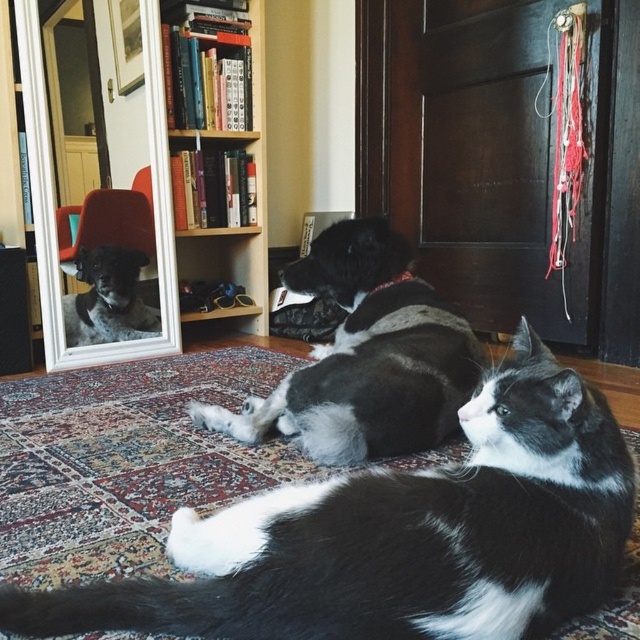
Question: Does black and white fur at center appear on the left side of wooden bookshelf at upper center?

Choices:
 (A) no
 (B) yes

Answer: (A)

Question: Which of the following is the farthest from the observer?

Choices:
 (A) black and white fur cat at center
 (B) black and white fur at center

Answer: (B)

Question: Is the position of black and white fur at center more distant than that of white-framed mirror at upper left?

Choices:
 (A) yes
 (B) no

Answer: (B)

Question: Which object is farther from the camera taking this photo?

Choices:
 (A) white-framed mirror at upper left
 (B) black and white fur cat at center

Answer: (A)

Question: Which point is farther from the camera taking this photo?

Choices:
 (A) (252, 234)
 (B) (51, 180)
 (C) (440, 346)
 (D) (456, 493)

Answer: (A)

Question: Is black and white fur at center smaller than white-framed mirror at upper left?

Choices:
 (A) yes
 (B) no

Answer: (B)